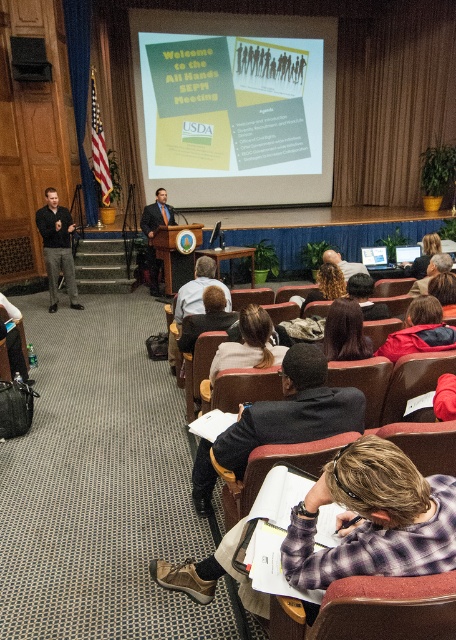
Question: Which point is closer to the camera?

Choices:
 (A) (222, 170)
 (B) (70, 304)
 (C) (253, 340)

Answer: (C)

Question: Does dark brown hair at center have a larger size compared to light brown leather jacket at center?

Choices:
 (A) no
 (B) yes

Answer: (A)

Question: Can you confirm if light brown leather jacket at center is positioned below plaid fabric shirt at center?

Choices:
 (A) no
 (B) yes

Answer: (B)

Question: Is dark gray suit at center below brown hair at center?

Choices:
 (A) yes
 (B) no

Answer: (A)

Question: Among these objects, which one is nearest to the camera?

Choices:
 (A) matte black suit at center
 (B) light brown leather jacket at center

Answer: (B)

Question: Which point appears closest to the camera in this image?

Choices:
 (A) (311, 355)
 (B) (424, 269)
 (C) (241, 193)
 (D) (300, 316)

Answer: (A)